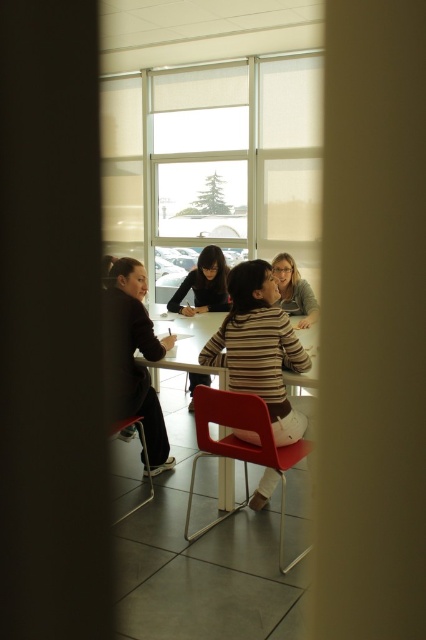
Question: From the image, what is the correct spatial relationship of matte plastic chair at center in relation to matte black shirt at center?

Choices:
 (A) left
 (B) right

Answer: (B)

Question: Is matte black shirt at center smaller than matte plastic chair at lower left?

Choices:
 (A) yes
 (B) no

Answer: (B)

Question: Which object appears farthest from the camera in this image?

Choices:
 (A) transparent glass window at upper center
 (B) dark gray sweater at left
 (C) matte plastic chair at lower left

Answer: (A)

Question: Among these points, which one is farthest from the camera?

Choices:
 (A) (213, 284)
 (B) (127, 422)

Answer: (A)

Question: From the image, what is the correct spatial relationship of transparent glass window at upper center in relation to matte plastic chair at lower left?

Choices:
 (A) above
 (B) below

Answer: (A)

Question: Which object is farther from the camera taking this photo?

Choices:
 (A) striped fabric shirt at center
 (B) matte plastic chair at lower left

Answer: (B)